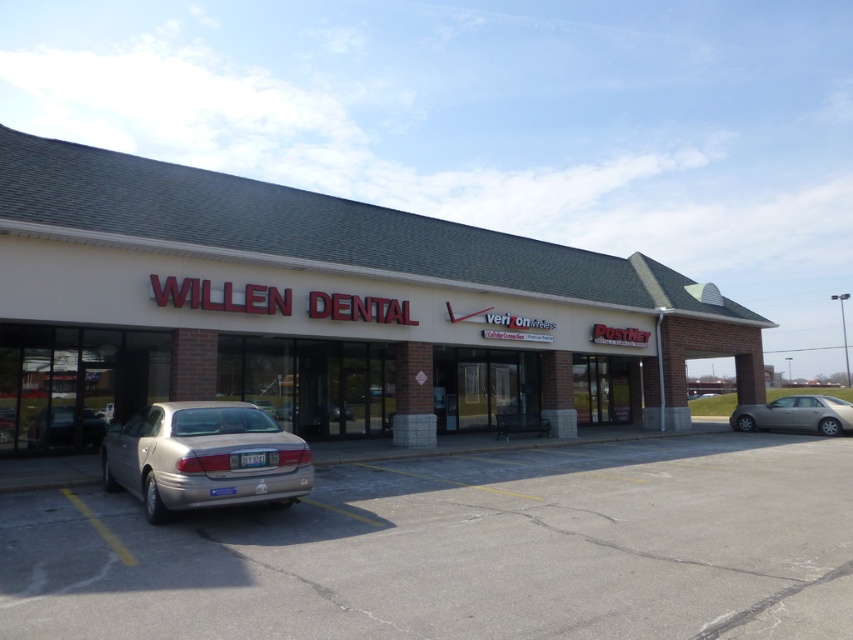
Question: Observing the image, what is the correct spatial positioning of satin gold sedan at lower left in reference to silver metallic sedan at lower left?

Choices:
 (A) below
 (B) above

Answer: (B)

Question: Which object is the farthest from the white brick building at center?

Choices:
 (A) silver metallic car at lower left
 (B) silver metallic sedan at right
 (C) silver metallic sedan at lower left
 (D) satin gold sedan at lower left

Answer: (B)

Question: Among these points, which one is nearest to the camera?

Choices:
 (A) (122, 515)
 (B) (71, 417)

Answer: (A)

Question: Can you confirm if silver metallic sedan at right is positioned to the left of silver metallic sedan at lower left?

Choices:
 (A) no
 (B) yes

Answer: (A)

Question: Does silver metallic car at lower left appear over silver metallic sedan at lower left?

Choices:
 (A) no
 (B) yes

Answer: (A)

Question: Considering the real-world distances, which object is closest to the silver metallic car at lower left?

Choices:
 (A) white brick building at center
 (B) satin gold sedan at lower left

Answer: (B)